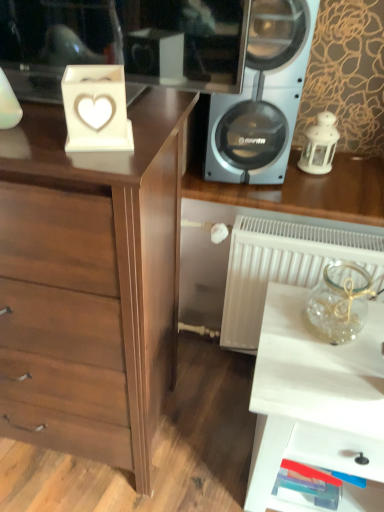
You are a GUI agent. You are given a task and a screenshot of the screen. Output one action in this format:
    pyautogui.click(x=<x>, y=<y>)
    Task: Click on the vacant region to the right of white porcelain lantern at right
    Image resolution: width=384 pixels, height=512 pixels.
    Given the screenshot: What is the action you would take?
    pyautogui.click(x=357, y=164)